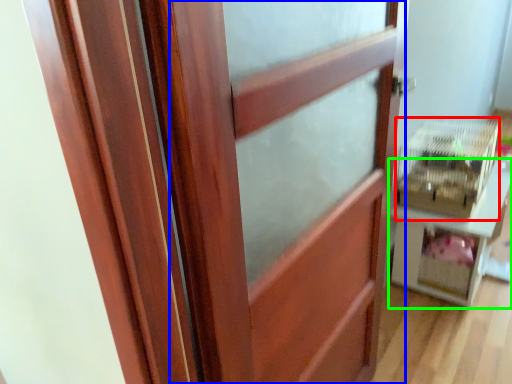
Question: Which is nearer to the crate (highlighted by a red box)? barn door (highlighted by a blue box) or furniture (highlighted by a green box).

Choices:
 (A) barn door
 (B) furniture

Answer: (B)